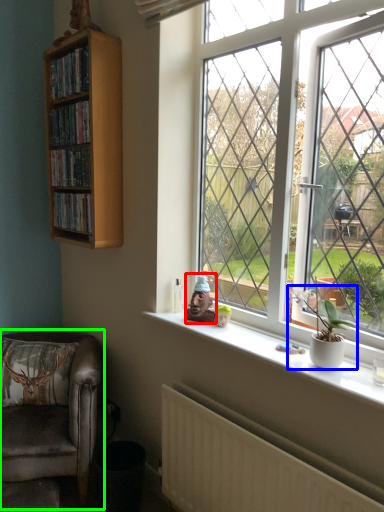
Question: Which object is positioned farthest from toy (highlighted by a red box)? Select from houseplant (highlighted by a blue box) and chair (highlighted by a green box).

Choices:
 (A) houseplant
 (B) chair

Answer: (B)